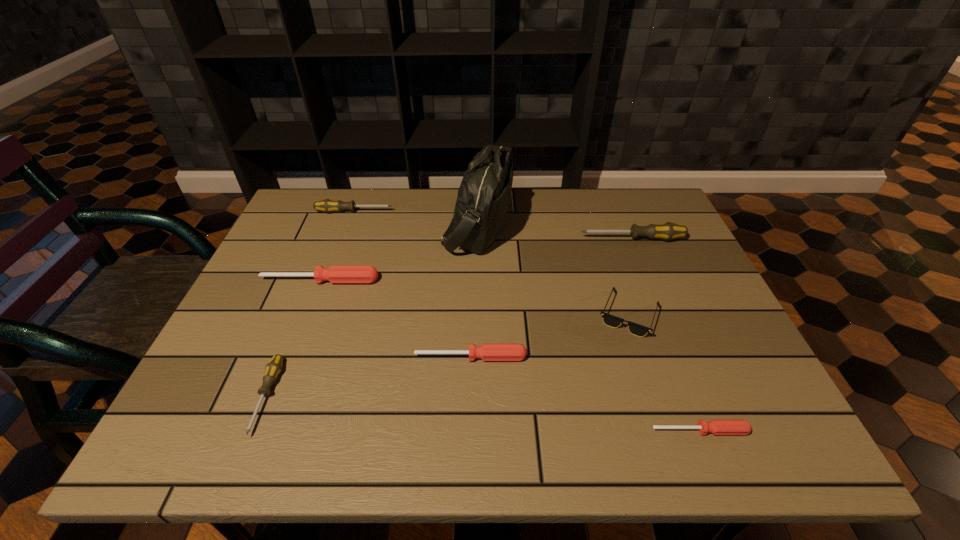
Image resolution: width=960 pixels, height=540 pixels. Find the location of `vacant area at the left edge of the desktop`. vacant area at the left edge of the desktop is located at coordinates (321, 245).

Identify the location of vacant space at the right edge. The image size is (960, 540). (647, 274).

Identify the location of vacant area at the far left corner. (293, 229).

In the image, there is a desktop. Identify the location of vacant space at the far right corner. This screenshot has height=540, width=960. (655, 202).

Where is `empty space between the fourth nearest object and the third farthest screwdriver`? This screenshot has height=540, width=960. empty space between the fourth nearest object and the third farthest screwdriver is located at coordinates (474, 297).

I want to click on vacant area that lies between the black sunglasses and the rightmost gray screwdriver, so click(x=631, y=276).

Where is `vacant point located between the shoulder bag and the farthest gray screwdriver`? Image resolution: width=960 pixels, height=540 pixels. vacant point located between the shoulder bag and the farthest gray screwdriver is located at coordinates click(x=416, y=219).

This screenshot has width=960, height=540. Identify the location of unoccupied position between the shortest screwdriver and the second biggest gray screwdriver. (527, 321).

Identify the location of empty space between the fourth nearest object and the fourth screwdriver from left to right. The width and height of the screenshot is (960, 540). (550, 335).

At what (x,y) coordinates should I click in order to perform the action: click on empty location between the rightmost red screwdriver and the tallest object. Please return your answer as a coordinate pair (x, y). This screenshot has width=960, height=540. Looking at the image, I should click on (588, 328).